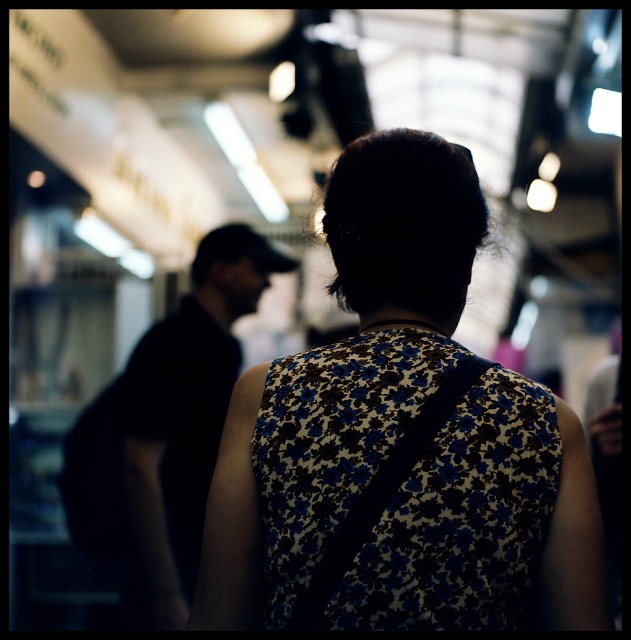
Question: Considering the relative positions of floral-patterned dress at center and black matte shirt at left in the image provided, where is floral-patterned dress at center located with respect to black matte shirt at left?

Choices:
 (A) right
 (B) left

Answer: (A)

Question: Which object appears farthest from the camera in this image?

Choices:
 (A) floral-patterned fabric dress at center
 (B) floral-patterned dress at center
 (C) black matte shirt at left

Answer: (C)

Question: Is floral-patterned dress at center thinner than floral-patterned fabric dress at center?

Choices:
 (A) no
 (B) yes

Answer: (A)

Question: Which point is farther to the camera?

Choices:
 (A) (297, 508)
 (B) (225, 337)

Answer: (B)

Question: Among these objects, which one is nearest to the camera?

Choices:
 (A) floral-patterned fabric dress at center
 (B) black matte shirt at left

Answer: (A)

Question: Does floral-patterned dress at center appear over black matte shirt at left?

Choices:
 (A) yes
 (B) no

Answer: (A)